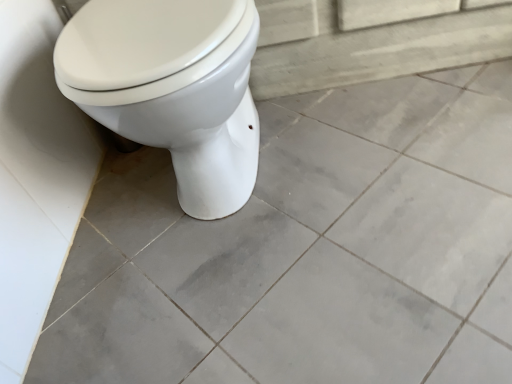
The image size is (512, 384). What are the coordinates of `vacant space underneath white glossy toilet at center (from a real-world perspective)` in the screenshot? It's located at (247, 197).